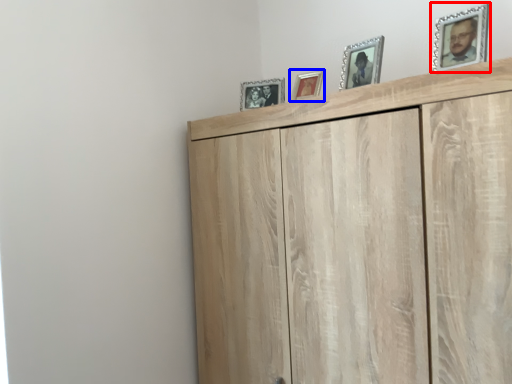
Question: Which object appears closest to the camera in this image, picture frame (highlighted by a red box) or picture frame (highlighted by a blue box)?

Choices:
 (A) picture frame
 (B) picture frame

Answer: (A)